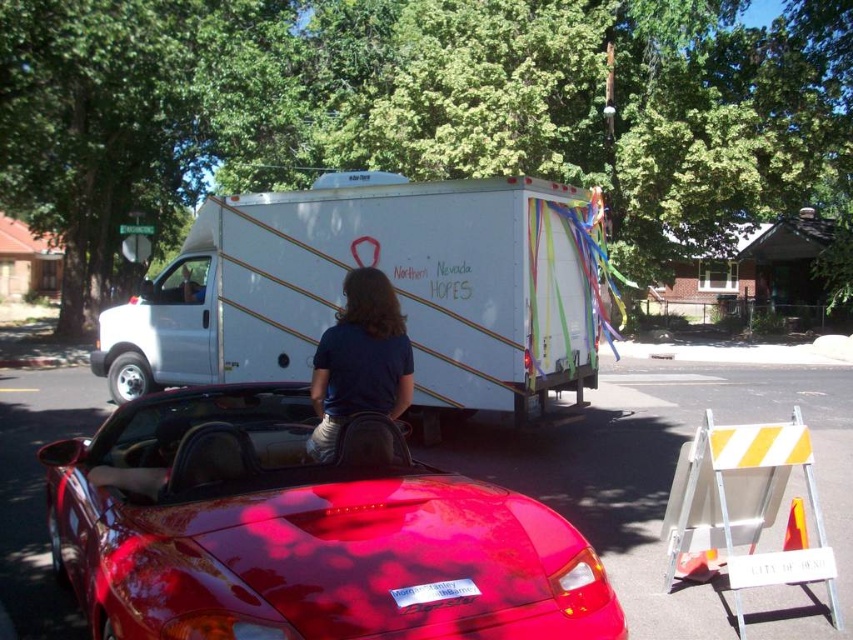
Can you confirm if glossy red convertible at center is positioned to the right of white matte truck at center?

Yes, glossy red convertible at center is to the right of white matte truck at center.

Between glossy red convertible at center and white matte truck at center, which one is positioned lower?

Positioned lower is glossy red convertible at center.

Find the location of a particular element. The height and width of the screenshot is (640, 853). glossy red convertible at center is located at coordinates (302, 532).

Locate an element on the screen. This screenshot has width=853, height=640. glossy red convertible at center is located at coordinates (302, 532).

Is white matte truck at center bigger than dark blue shirt at center?

Incorrect, white matte truck at center is not larger than dark blue shirt at center.

Is white matte truck at center smaller than dark blue shirt at center?

Yes, white matte truck at center is smaller than dark blue shirt at center.

Between point (219, 214) and point (346, 380), which one is positioned in front?

Point (346, 380) is more forward.

You are a GUI agent. You are given a task and a screenshot of the screen. Output one action in this format:
    pyautogui.click(x=<x>, y=<y>)
    Task: Click on the white matte truck at center
    
    Given the screenshot: What is the action you would take?
    pos(392,282)

Which of these two, glossy red convertible at center or dark blue shirt at center, stands shorter?

Standing shorter between the two is dark blue shirt at center.

Is point (125, 548) farther from viewer compared to point (325, 420)?

No.

The image size is (853, 640). Describe the element at coordinates (302, 532) in the screenshot. I see `glossy red convertible at center` at that location.

Locate an element on the screen. The width and height of the screenshot is (853, 640). glossy red convertible at center is located at coordinates (302, 532).